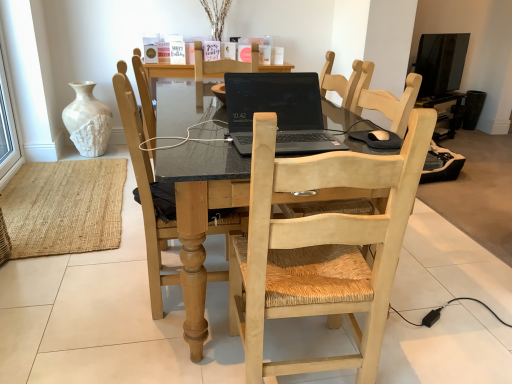
At what (x,y) coordinates should I click in order to perform the action: click on vacant space that is to the left of light wood chair at center, the second chair when ordered from right to left. Please return your answer as a coordinate pair (x, y). The height and width of the screenshot is (384, 512). Looking at the image, I should click on (101, 288).